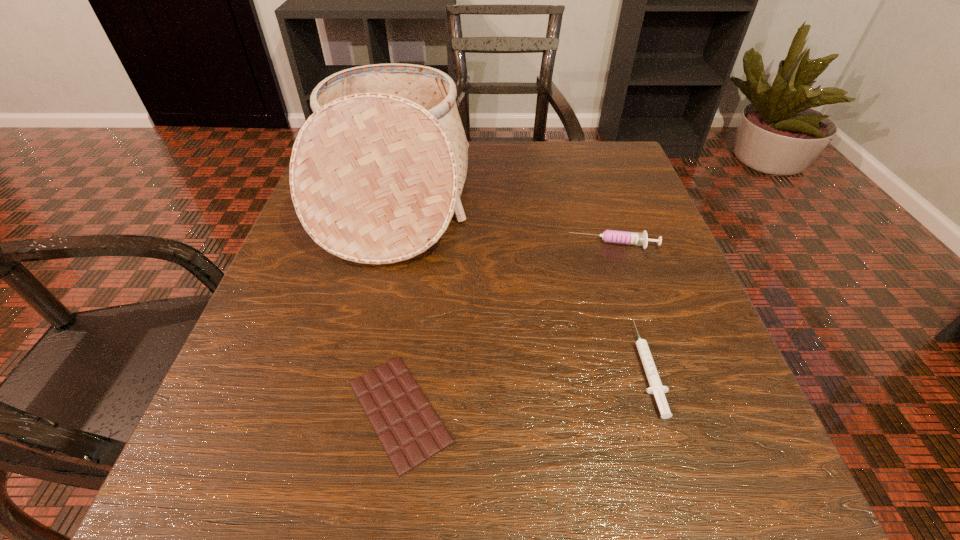
Identify which object is the nearest to the shortest object. Please provide its 2D coordinates. Your answer should be formatted as a tuple, i.e. [(x, y)], where the tuple contains the x and y coordinates of a point satisfying the conditions above.

[(376, 174)]

In order to click on object that can be found as the second closest to the farther syringe in this screenshot , I will do `click(376, 174)`.

The height and width of the screenshot is (540, 960). In order to click on vacant point that satisfies the following two spatial constraints: 1. on the back side of the nearer syringe; 2. with the lid open on the tallest object in this screenshot , I will do `click(594, 197)`.

Find the location of `free point that satisfies the following two spatial constraints: 1. on the back side of the second tallest object; 2. with the lid open on the tallest object`. free point that satisfies the following two spatial constraints: 1. on the back side of the second tallest object; 2. with the lid open on the tallest object is located at coordinates (598, 197).

Find the location of a particular element. The width and height of the screenshot is (960, 540). free location that satisfies the following two spatial constraints: 1. with the lid open on the tallest object; 2. on the right side of the shortest object is located at coordinates (343, 411).

This screenshot has width=960, height=540. In order to click on free spot that satisfies the following two spatial constraints: 1. with the lid open on the tallest object; 2. on the right side of the taller syringe in this screenshot , I will do `click(383, 245)`.

What are the coordinates of `free spot that satisfies the following two spatial constraints: 1. with the lid open on the third tallest object; 2. on the left side of the tallest object` in the screenshot? It's located at (353, 367).

Where is `free spot that satisfies the following two spatial constraints: 1. with the lid open on the third shortest object; 2. on the right side of the basket`? free spot that satisfies the following two spatial constraints: 1. with the lid open on the third shortest object; 2. on the right side of the basket is located at coordinates (383, 245).

This screenshot has height=540, width=960. I want to click on free region that satisfies the following two spatial constraints: 1. on the back side of the third shortest object; 2. with the lid open on the basket, so click(x=598, y=197).

I want to click on blank space that satisfies the following two spatial constraints: 1. with the lid open on the taller syringe; 2. on the right side of the tallest object, so click(x=383, y=245).